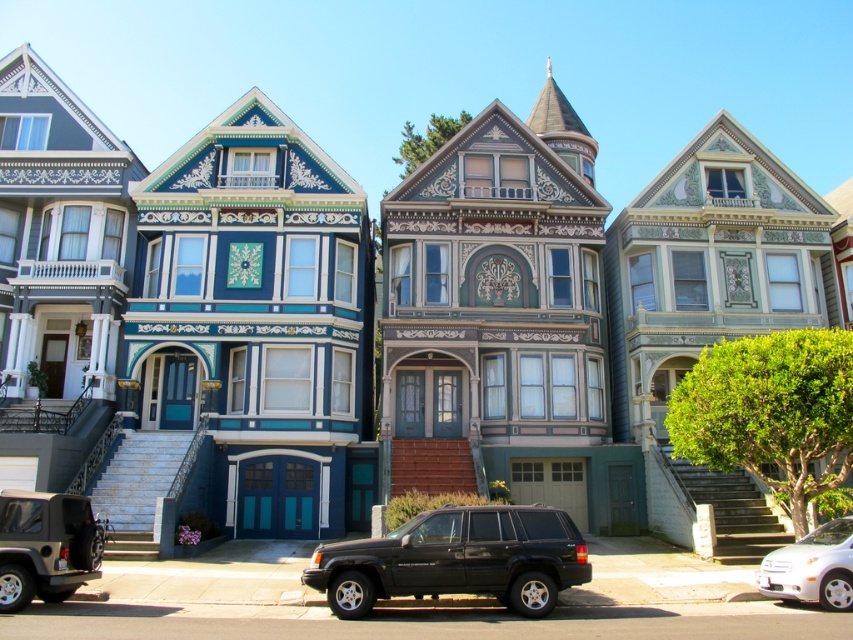
Question: Is matte black suv at center positioned before white glossy sedan at lower right?

Choices:
 (A) no
 (B) yes

Answer: (B)

Question: Which point is farther to the camera?

Choices:
 (A) (573, 540)
 (B) (834, 588)
 (C) (97, 563)

Answer: (C)

Question: Estimate the real-world distances between objects in this image. Which object is closer to the matte black suv at lower left?

Choices:
 (A) white glossy sedan at lower right
 (B) matte black suv at center

Answer: (B)

Question: Can you confirm if matte black suv at center is positioned above white glossy sedan at lower right?

Choices:
 (A) yes
 (B) no

Answer: (A)

Question: Which point is farther from the camera taking this photo?

Choices:
 (A) (804, 550)
 (B) (497, 561)

Answer: (A)

Question: Does matte black suv at center appear on the left side of matte black suv at lower left?

Choices:
 (A) no
 (B) yes

Answer: (A)